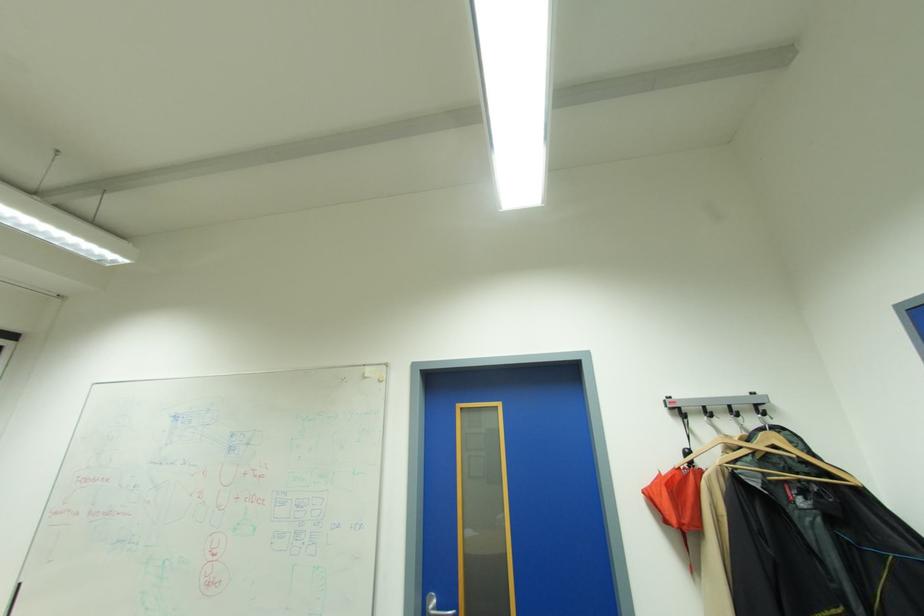
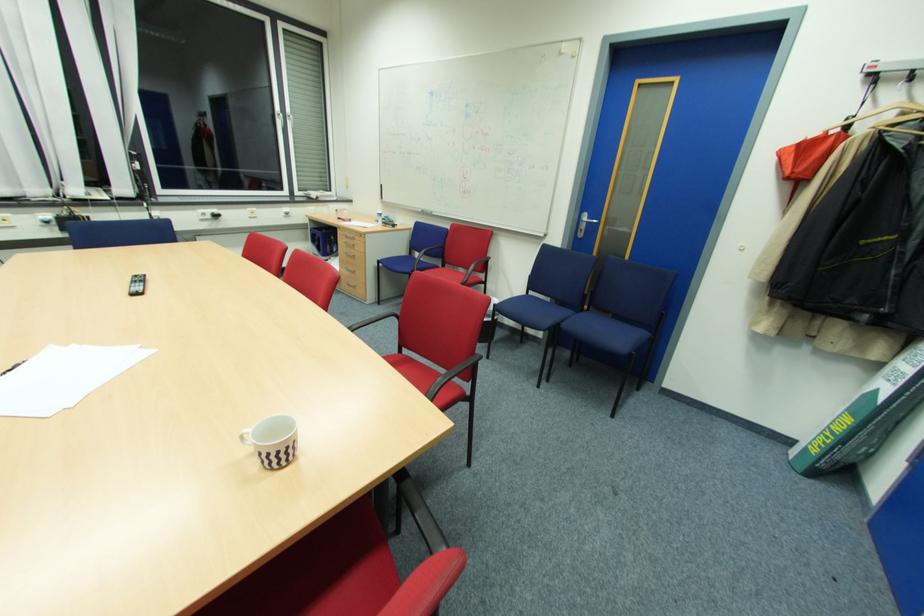
First-person continuous shooting, in which direction is the camera rotating?

The camera rotated toward left-down.